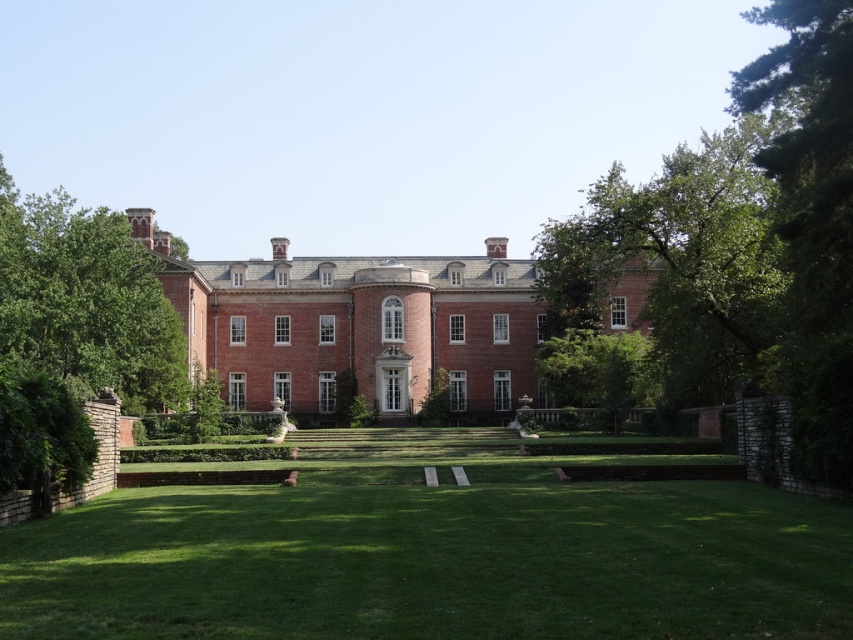
You are standing at the entrance of the grand brick mansion and want to walk straight ahead towards the lawn. According to the image, where will you first step onto the green grass at center?

The green grass at center is located at point (434, 557), so you will first step onto it at that coordinate.